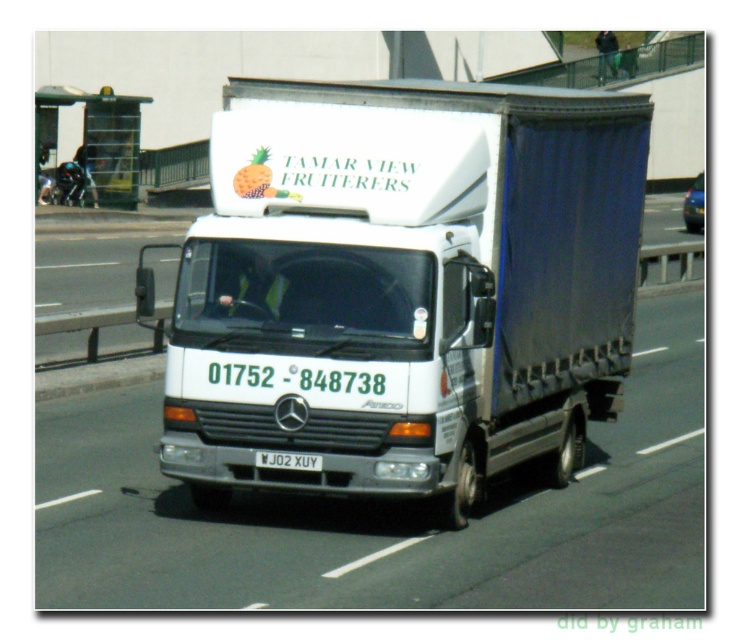
Which is in front, point (278, 451) or point (686, 208)?

Positioned in front is point (278, 451).

Is point (266, 452) behind point (689, 204)?

No, (266, 452) is in front of (689, 204).

Is point (262, 458) positioned before point (686, 212)?

Yes, it is in front of point (686, 212).

Find the location of a particular element. white plastic license plate at center is located at coordinates (289, 460).

Does white matte truck at center have a greater height compared to white plastic license plate at center?

Correct, white matte truck at center is much taller as white plastic license plate at center.

Measure the distance from white matte truck at center to white plastic license plate at center.

white matte truck at center is 32.93 inches away from white plastic license plate at center.

Is point (263, 380) farther from viewer compared to point (286, 461)?

No.

Identify the location of white matte truck at center. The height and width of the screenshot is (640, 740). (403, 285).

Based on the photo, is white matte truck at center bigger than metallic blue taxi at center?

Incorrect, white matte truck at center is not larger than metallic blue taxi at center.

Between white matte truck at center and metallic blue taxi at center, which one has more height?

With more height is metallic blue taxi at center.

Locate an element on the screen. This screenshot has width=740, height=640. white matte truck at center is located at coordinates (403, 285).